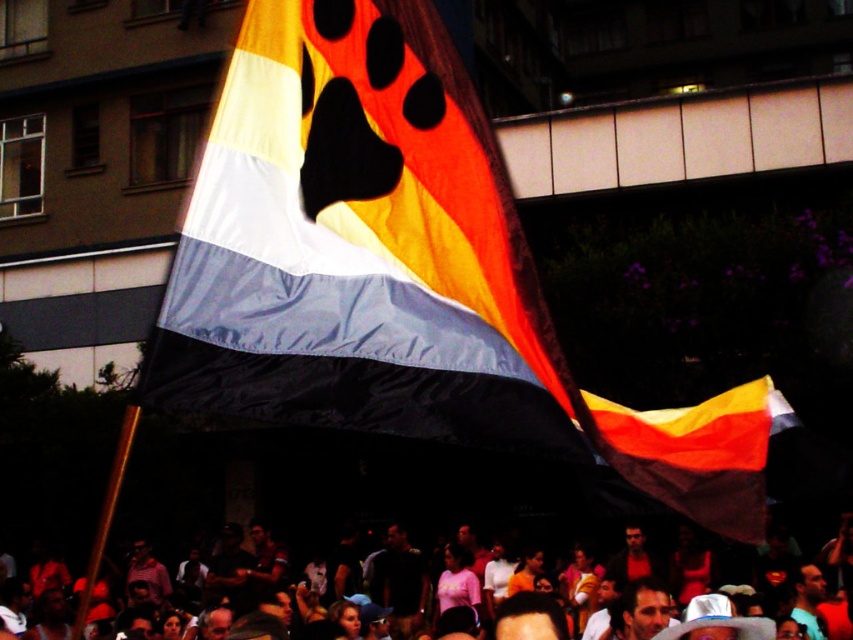
Question: Can you confirm if silky fabric flag at center is positioned to the right of matte orange crowd at lower center?

Choices:
 (A) yes
 (B) no

Answer: (A)

Question: Which point is closer to the camera?

Choices:
 (A) (425, 227)
 (B) (846, 627)

Answer: (A)

Question: Which object is closer to the camera taking this photo?

Choices:
 (A) silky fabric flag at center
 (B) matte orange crowd at lower center

Answer: (A)

Question: Is silky fabric flag at center to the right of matte orange crowd at lower center from the viewer's perspective?

Choices:
 (A) no
 (B) yes

Answer: (B)

Question: Considering the relative positions of silky fabric flag at center and matte orange crowd at lower center in the image provided, where is silky fabric flag at center located with respect to matte orange crowd at lower center?

Choices:
 (A) above
 (B) below

Answer: (A)